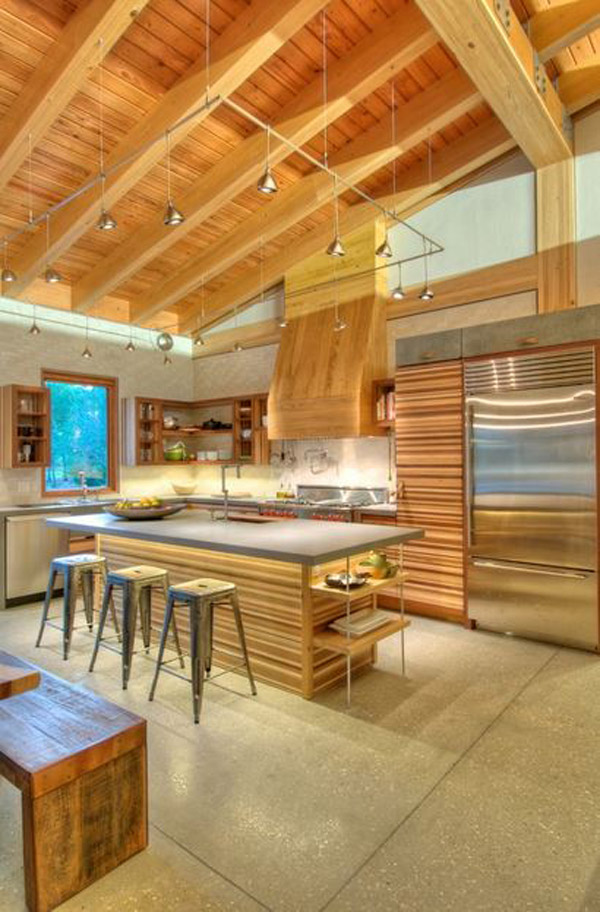
Identify the location of roof beams. [x=471, y=17], [x=258, y=50], [x=313, y=119].